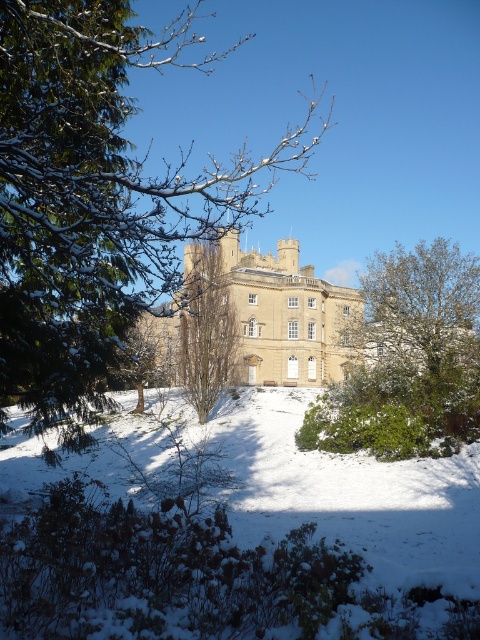
You are standing in front of the historic building and want to determine the distance between two specific points marked in the image. The first point is at coordinate point (47, 29) and the second is at point (472, 298). Based on the scene description, which point is closer to you?

Point (47, 29) is closer to the viewer than point (472, 298).

You are standing at the base of the historic building and want to walk to the green leafy bush at lower right. How far will you have to walk?

The green leafy bush at lower right is located 82.79 meters away from the viewer, so you will have to walk approximately 82.79 meters to reach it.